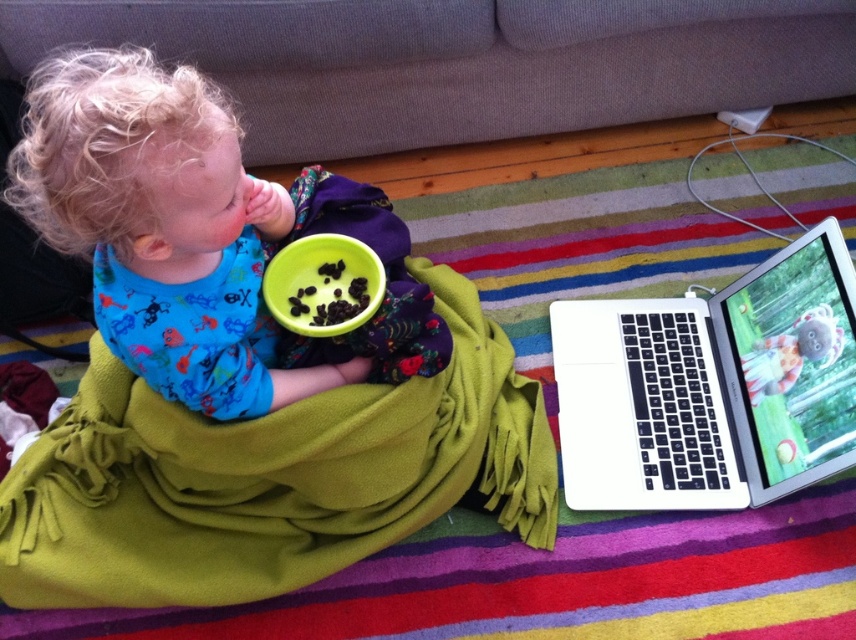
You are a parent trying to decide where to place a new toy. You see the gray fabric couch at upper center and the blue cotton shirt at center. Which object is closer to you?

The gray fabric couch at upper center is closer to you because it is further to the viewer than the blue cotton shirt at center.

You are a furniture designer who wants to place a new chair next to the gray fabric couch at upper center and the blue cotton shirt at center. Which object should the chair be placed closer to if it needs to accommodate more people?

The chair should be placed closer to the gray fabric couch at upper center because it has a larger width than the blue cotton shirt at center, making it better suited for accommodating more people.

You are a parent trying to decide whether to place a new toy on the green fleece blanket at center or the gray fabric couch at upper center. Based on their sizes, which surface would allow the toy to fit better?

The green fleece blanket at center is bigger than the gray fabric couch at upper center, so the toy would fit better on the green fleece blanket at center.